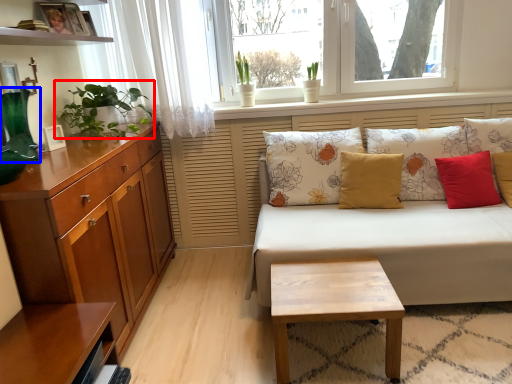
Question: Among these objects, which one is farthest to the camera, houseplant (highlighted by a red box) or vase (highlighted by a blue box)?

Choices:
 (A) houseplant
 (B) vase

Answer: (A)